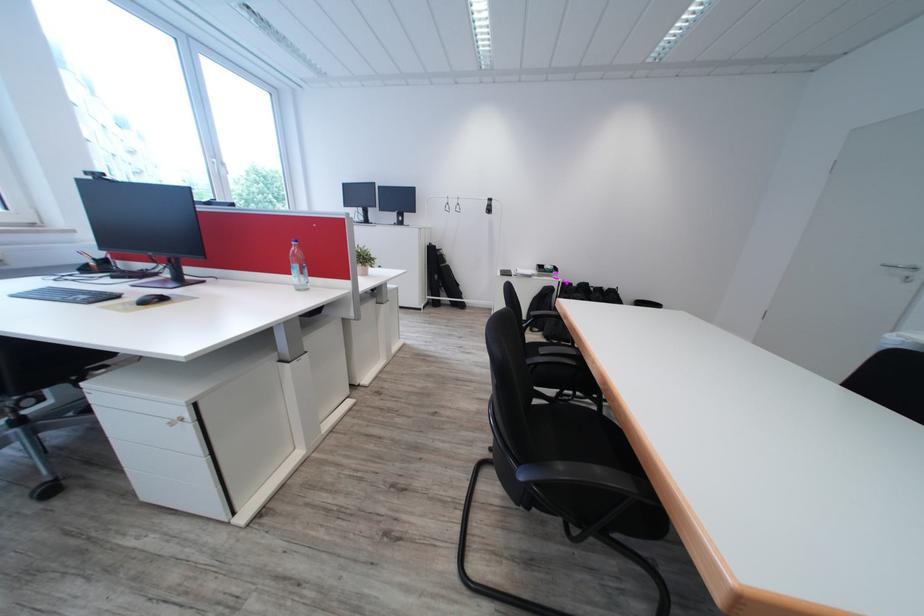
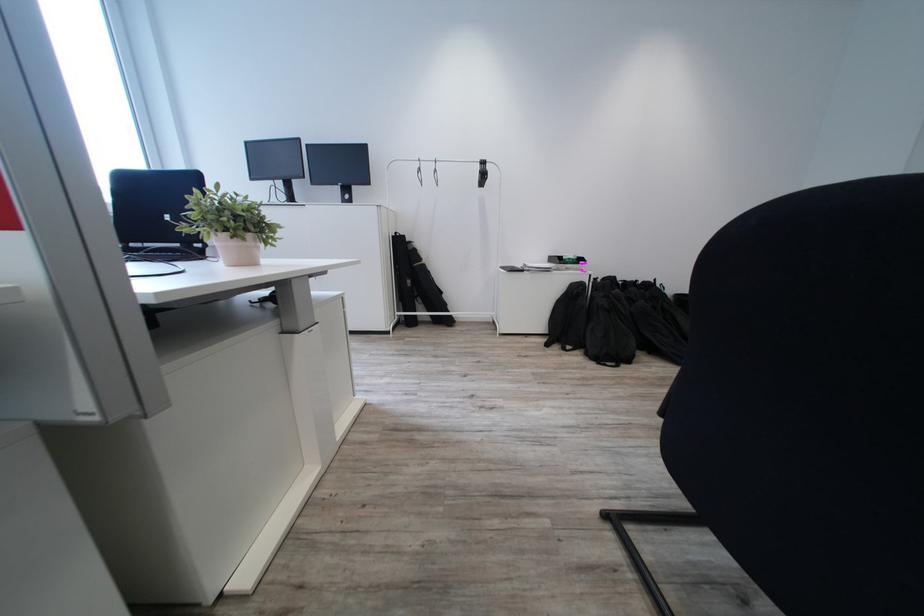
Question: Which direction would the cameraman need to move to produce the second image? Reply with the corresponding letter.

Choices:
 (A) Left
 (B) Right
 (C) Forward
 (D) Backward

Answer: (C)